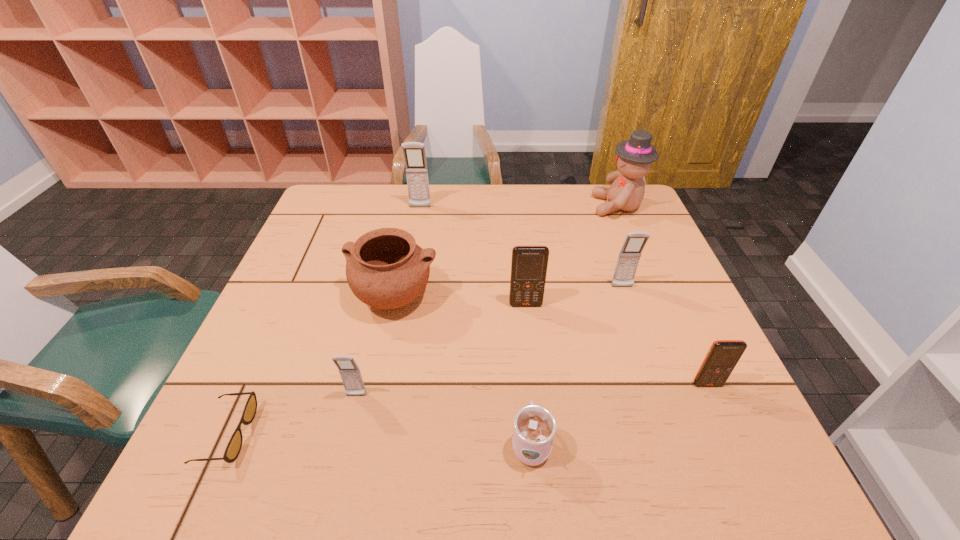
Where is `free space located on the screen of the third cellular telephone from left to right`? The image size is (960, 540). free space located on the screen of the third cellular telephone from left to right is located at coordinates (532, 358).

Image resolution: width=960 pixels, height=540 pixels. I want to click on vacant space located on the back of the terracotta pottery, so pyautogui.click(x=416, y=194).

Identify the location of vacant space located 0.180m on the screen of the right orange cellular telephone. The width and height of the screenshot is (960, 540). (749, 477).

Identify the location of blank area located on the front-facing side of the leftmost gray cellular telephone. (346, 437).

Locate an element on the screen. vacant space situated on the side with the handle of the cup is located at coordinates (525, 386).

This screenshot has height=540, width=960. I want to click on blank area located 0.230m on the side with the handle of the cup, so click(520, 327).

The image size is (960, 540). Find the location of `vacant space located 0.380m on the side with the handle of the cup`. vacant space located 0.380m on the side with the handle of the cup is located at coordinates (516, 283).

Locate an element on the screen. The width and height of the screenshot is (960, 540). free space located on the front-facing side of the shortest object is located at coordinates (328, 434).

Image resolution: width=960 pixels, height=540 pixels. What are the coordinates of `rag_doll present at the far edge` in the screenshot? It's located at (634, 157).

Locate an element on the screen. The height and width of the screenshot is (540, 960). cellular telephone that is at the far edge is located at coordinates (414, 154).